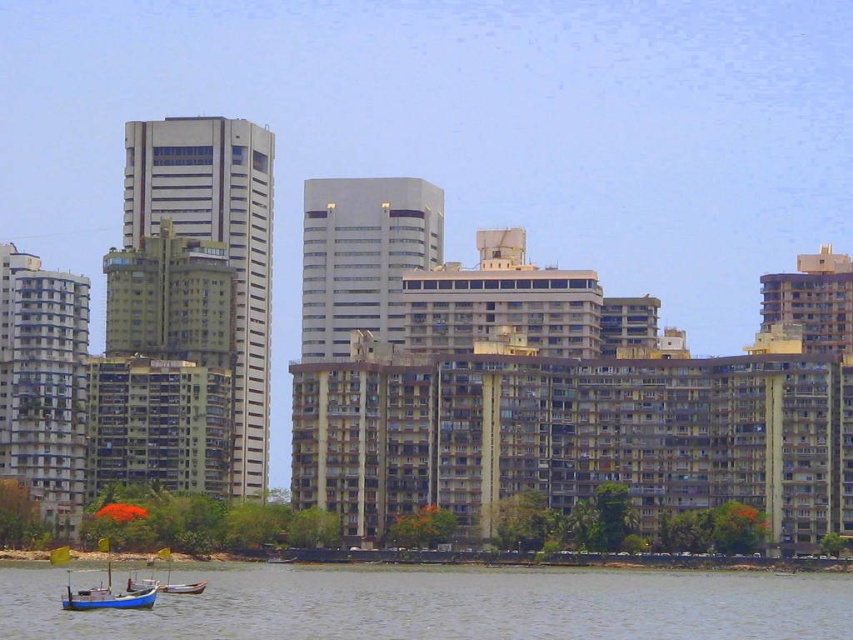
Question: Which object is farther from the camera taking this photo?

Choices:
 (A) blue wooden boat at lower left
 (B) greenish water at lower left

Answer: (A)

Question: From the image, what is the correct spatial relationship of greenish water at lower left in relation to blue wooden boat at lower left?

Choices:
 (A) above
 (B) below

Answer: (B)

Question: Which object appears closest to the camera in this image?

Choices:
 (A) greenish water at lower left
 (B) blue wooden boat at lower left

Answer: (A)

Question: Which point is closer to the camera taking this photo?

Choices:
 (A) pyautogui.click(x=115, y=608)
 (B) pyautogui.click(x=746, y=595)

Answer: (A)

Question: Can you confirm if greenish water at lower left is wider than blue wooden boat at lower left?

Choices:
 (A) no
 (B) yes

Answer: (B)

Question: Does greenish water at lower left come behind blue wooden boat at lower left?

Choices:
 (A) yes
 (B) no

Answer: (B)